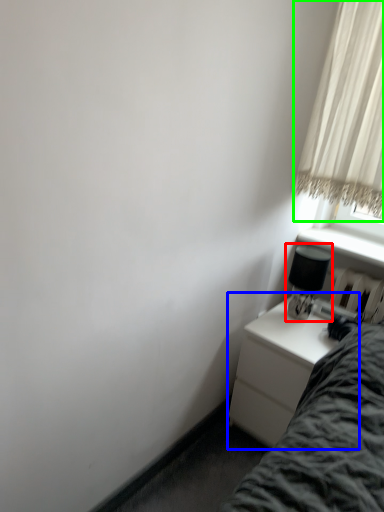
Question: Considering the real-world distances, which object is farthest from table lamp (highlighted by a red box)? nightstand (highlighted by a blue box) or curtain (highlighted by a green box)?

Choices:
 (A) nightstand
 (B) curtain

Answer: (B)